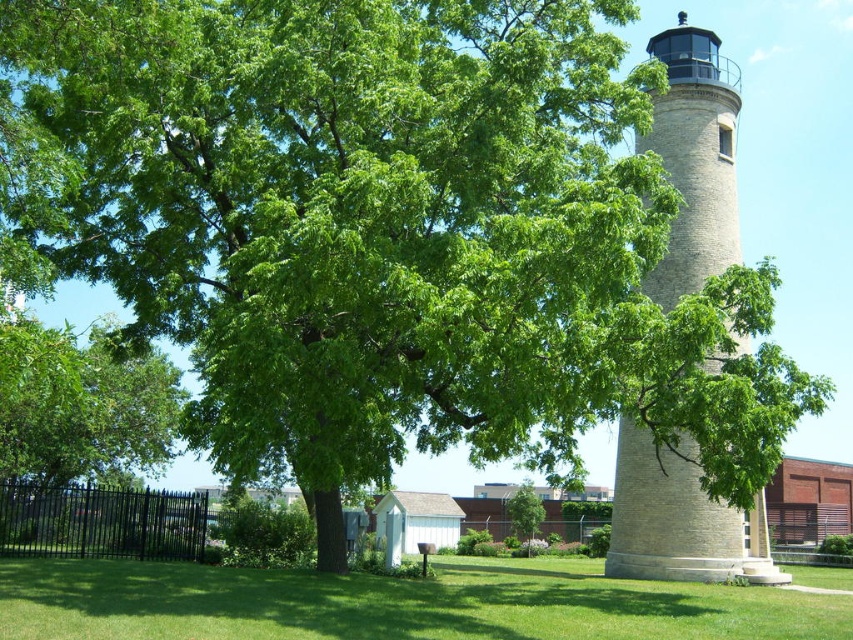
You are standing in the middle of the scene and want to take a photo that includes both the beige stone lighthouse at right and the green leafy tree at center. Which object should you position closer to the edge of the frame to ensure both are fully visible?

You should position the beige stone lighthouse at right closer to the edge of the frame because it is located above the green leafy tree at center, so placing it towards the edge will allow both objects to fit within the photo.

You are standing at the base of the lighthouse and want to walk to the point marked as point (7,419). However, there is an obstacle at point (831,637). Which point is closer to you, and should you adjust your path to avoid the obstacle?

Point (831,637) is closer to you than point (7,419). Therefore, you should adjust your path to avoid the obstacle at point (831,637) before proceeding to point (7,419).

You are a park ranger who needs to place a new bench between the beige stone lighthouse at right and the green leafy tree at center. The bench requires a minimum of 10 feet of space to be placed safely. Is there enough space between them?

The beige stone lighthouse at right is 63.24 feet away from the green leafy tree at center, so yes, there is enough space to place the bench between them since the distance exceeds the required 10 feet.